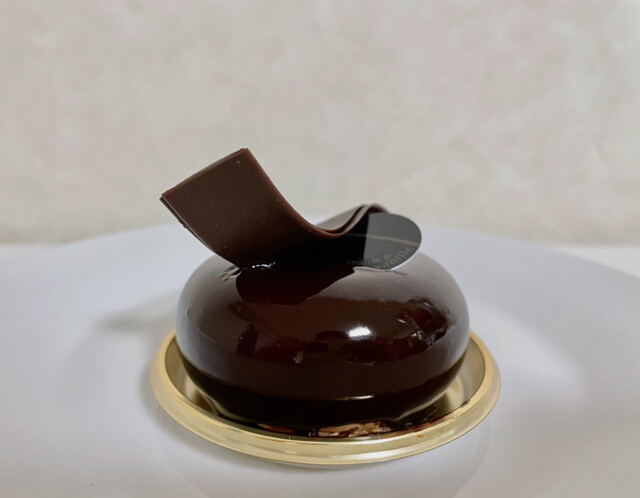
I want to click on white plate, so click(547, 324).